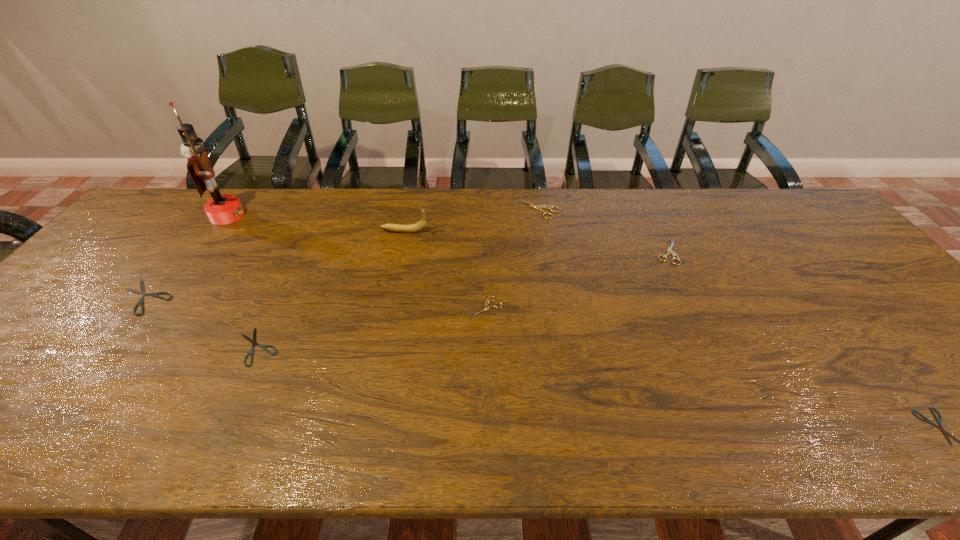
Identify the location of the nearest beige shears. This screenshot has height=540, width=960. (486, 304).

I want to click on the fourth object from right to left, so click(486, 304).

This screenshot has width=960, height=540. In order to click on the second nearest black shears in this screenshot , I will do `click(253, 341)`.

Where is `the second black shears from right to left`? This screenshot has height=540, width=960. the second black shears from right to left is located at coordinates (253, 341).

The height and width of the screenshot is (540, 960). Find the location of `free space located on the front-facing side of the red nutcracker`. free space located on the front-facing side of the red nutcracker is located at coordinates (323, 215).

Image resolution: width=960 pixels, height=540 pixels. In order to click on free space located 0.120m at the stem of the third farthest object in this screenshot , I will do `click(466, 231)`.

Find the location of `blank space located 0.180m on the right of the farthest beige shears`. blank space located 0.180m on the right of the farthest beige shears is located at coordinates (614, 210).

Where is `free location located 0.320m on the left of the rightmost beige shears`? The image size is (960, 540). free location located 0.320m on the left of the rightmost beige shears is located at coordinates (546, 252).

Identify the location of free space located 0.390m on the back of the biggest black shears. The width and height of the screenshot is (960, 540). (220, 201).

Identify the location of free space located 0.360m on the right of the leftmost beige shears. (641, 307).